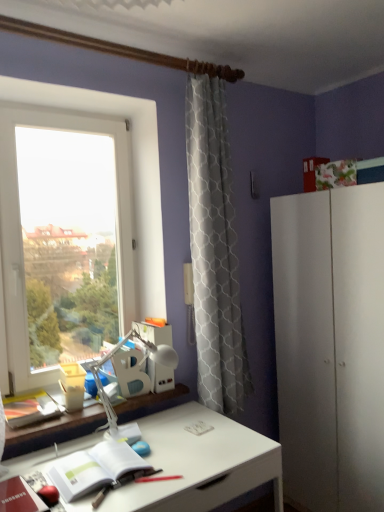
Question: Is white paper notebook at lower left turned away from transparent glass window at left?

Choices:
 (A) yes
 (B) no

Answer: (B)

Question: Is white paper notebook at lower left at the right side of transparent glass window at left?

Choices:
 (A) no
 (B) yes

Answer: (B)

Question: Does white paper notebook at lower left have a greater height compared to transparent glass window at left?

Choices:
 (A) yes
 (B) no

Answer: (B)

Question: Does white paper notebook at lower left have a smaller size compared to transparent glass window at left?

Choices:
 (A) yes
 (B) no

Answer: (A)

Question: Is white paper notebook at lower left not close to transparent glass window at left?

Choices:
 (A) yes
 (B) no

Answer: (B)

Question: Is point (228, 462) positioned closer to the camera than point (134, 141)?

Choices:
 (A) closer
 (B) farther

Answer: (A)

Question: From the image's perspective, is white glossy desk at center above or below transparent glass window at left?

Choices:
 (A) above
 (B) below

Answer: (B)

Question: In terms of width, does white glossy desk at center look wider or thinner when compared to transparent glass window at left?

Choices:
 (A) wide
 (B) thin

Answer: (A)

Question: Considering the positions of white glossy desk at center and transparent glass window at left in the image, is white glossy desk at center taller or shorter than transparent glass window at left?

Choices:
 (A) short
 (B) tall

Answer: (A)

Question: Is white glossy desk at center wider or thinner than white paper notebook at lower left?

Choices:
 (A) wide
 (B) thin

Answer: (A)

Question: From a real-world perspective, is white glossy desk at center positioned above or below white paper notebook at lower left?

Choices:
 (A) below
 (B) above

Answer: (A)

Question: Based on their sizes in the image, would you say white glossy desk at center is bigger or smaller than white paper notebook at lower left?

Choices:
 (A) big
 (B) small

Answer: (A)

Question: Is white glossy desk at center inside or outside of white paper notebook at lower left?

Choices:
 (A) inside
 (B) outside

Answer: (B)

Question: From the image's perspective, is white plastic table lamp at center positioned above or below white matte cabinet at right?

Choices:
 (A) above
 (B) below

Answer: (A)

Question: Is white plastic table lamp at center taller or shorter than white matte cabinet at right?

Choices:
 (A) tall
 (B) short

Answer: (B)